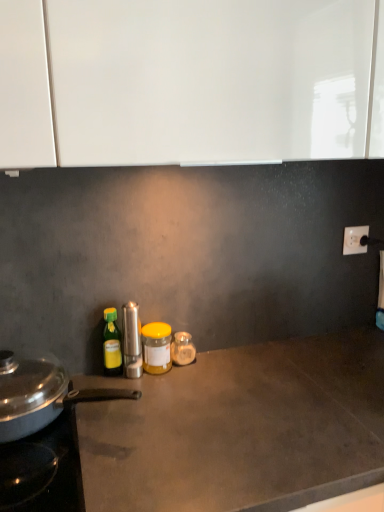
Question: Would you say white plastic electric outlet at upper right is part of yellow matte jar at center, which ranks as the second bottle in left-to-right order,'s contents?

Choices:
 (A) yes
 (B) no

Answer: (B)

Question: Is yellow matte jar at center, which ranks as the second bottle in left-to-right order, taller than white plastic electric outlet at upper right?

Choices:
 (A) yes
 (B) no

Answer: (A)

Question: From the image's perspective, is yellow matte jar at center, which is the 2th bottle from right to left, below white plastic electric outlet at upper right?

Choices:
 (A) no
 (B) yes

Answer: (B)

Question: Is yellow matte jar at center, which ranks as the second bottle in left-to-right order, located outside white plastic electric outlet at upper right?

Choices:
 (A) yes
 (B) no

Answer: (A)

Question: Considering the relative sizes of yellow matte jar at center, which ranks as the second bottle in left-to-right order, and white plastic electric outlet at upper right in the image provided, is yellow matte jar at center, which ranks as the second bottle in left-to-right order, smaller than white plastic electric outlet at upper right?

Choices:
 (A) no
 (B) yes

Answer: (A)

Question: Is yellow matte jar at center, which is the 2th bottle from right to left, further to camera compared to white plastic electric outlet at upper right?

Choices:
 (A) no
 (B) yes

Answer: (A)

Question: Does white plastic electric outlet at upper right have a greater height compared to translucent glass jar at center, arranged as the third bottle when viewed from the left?

Choices:
 (A) no
 (B) yes

Answer: (B)

Question: From the image's perspective, is white plastic electric outlet at upper right located beneath translucent glass jar at center, arranged as the third bottle when viewed from the left?

Choices:
 (A) no
 (B) yes

Answer: (A)

Question: Is white plastic electric outlet at upper right outside translucent glass jar at center, marked as the first bottle in a right-to-left arrangement?

Choices:
 (A) yes
 (B) no

Answer: (A)

Question: Considering the relative positions of white plastic electric outlet at upper right and translucent glass jar at center, marked as the first bottle in a right-to-left arrangement, in the image provided, is white plastic electric outlet at upper right to the left of translucent glass jar at center, marked as the first bottle in a right-to-left arrangement, from the viewer's perspective?

Choices:
 (A) yes
 (B) no

Answer: (B)

Question: Would you consider white plastic electric outlet at upper right to be distant from translucent glass jar at center, arranged as the third bottle when viewed from the left?

Choices:
 (A) yes
 (B) no

Answer: (B)

Question: Can you see white plastic electric outlet at upper right touching translucent glass jar at center, marked as the first bottle in a right-to-left arrangement?

Choices:
 (A) no
 (B) yes

Answer: (A)

Question: Could you tell me if yellow matte jar at center, which ranks as the second bottle in left-to-right order, is facing satin silver pepper mill at center, the 2th kitchen appliance in the left-to-right sequence?

Choices:
 (A) yes
 (B) no

Answer: (B)